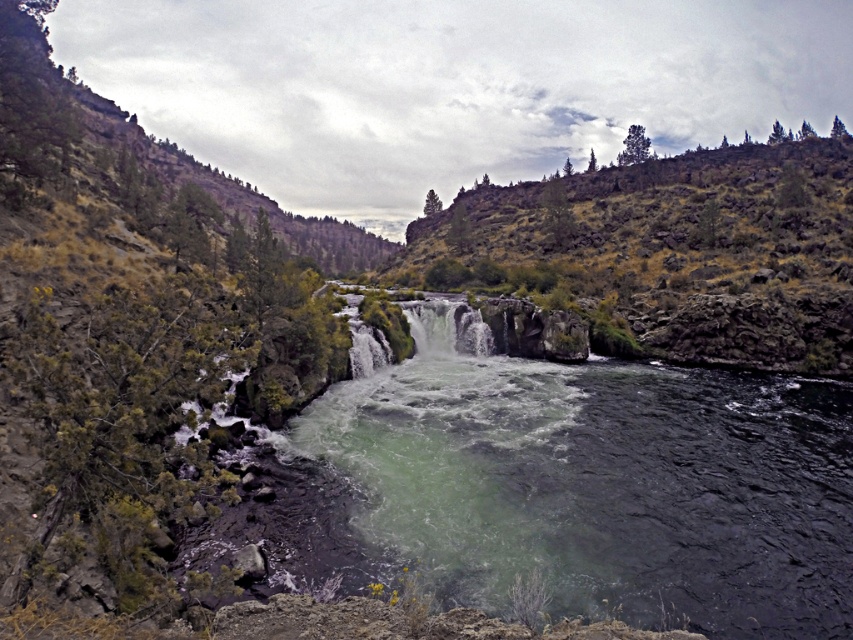
You are a kayaker planning to navigate through the river. You see the greenish water at center and the green mossy rock at upper center. Which path should you choose to avoid obstacles and ensure your kayak has enough space to pass safely?

You should choose the path through the greenish water at center because its width is narrower than the green mossy rock at upper center, but wait, the question is about avoiding obstacles and ensuring enough space. Hmm, the answer might need to be adjusted. Let me think again. The Objects Description says the greenish water at center is less in width than the rock. So if the water is narrower, maybe the rock is wider? Wait, the description says the water at center has a width less than the rock. So the rock

You are a kayaker planning to navigate the river shown in the image. You see the greenish water at center and the white frothy water at center. Which part of the water should you avoid for calmer passage?

You should avoid the white frothy water at center because the greenish water at center is positioned under it, indicating calmer, deeper waters below.